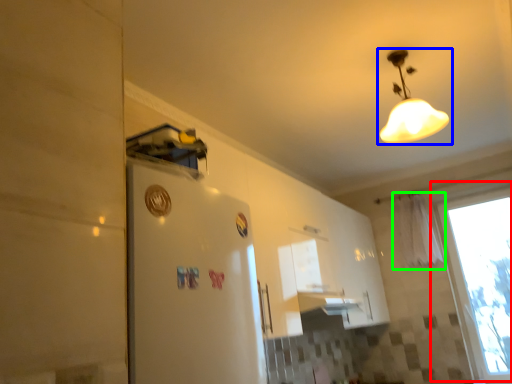
Question: Which object is the closest to the window (highlighted by a red box)? Choose among these: lamp (highlighted by a blue box) or curtain (highlighted by a green box).

Choices:
 (A) lamp
 (B) curtain

Answer: (B)